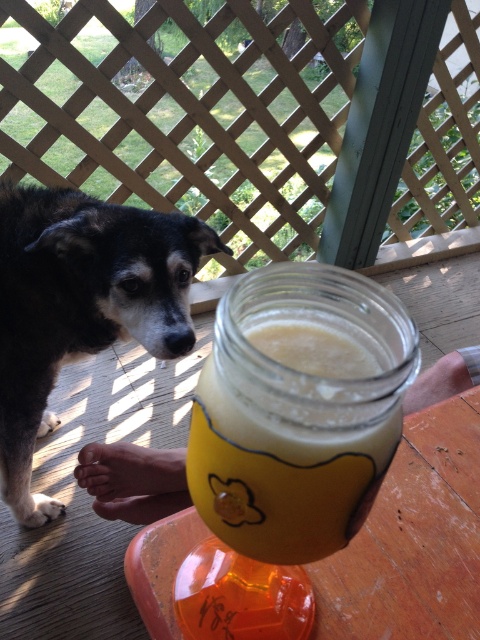
Which is below, black fur dog at left or yellow matte jar at center?

black fur dog at left is lower down.

Locate an element on the screen. The width and height of the screenshot is (480, 640). black fur dog at left is located at coordinates (81, 307).

Identify the location of black fur dog at left. (x=81, y=307).